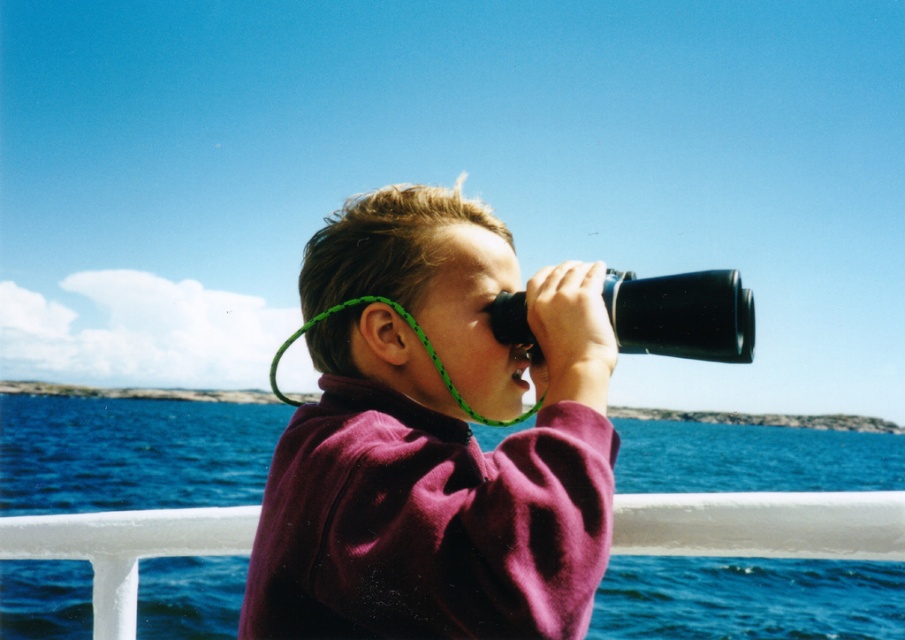
The scene shows a child on a boat with a white railing. The child is wearing a maroon sweater and holding black binoculars with a green strap. There is a point marked at coordinates [435,440]. What object is located at that point?

The point at coordinates [435,440] indicates a purple fleece jacket at center.

You are a photographer trying to capture the blue water at lower center in your shot. The purple fleece jacket at center is blocking your view. Can you estimate whether the jacket is small enough to move out of the frame without needing to adjust your camera angle much?

The purple fleece jacket at center has a smaller size compared to blue water at lower center, so it can be moved out of the frame easily without adjusting the camera angle much.